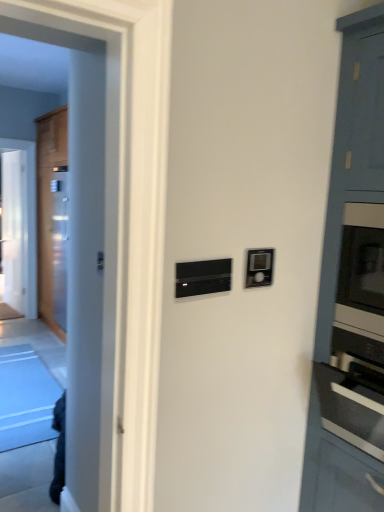
Question: Is transparent glass door at left positioned in front of satin silver oven at right?

Choices:
 (A) no
 (B) yes

Answer: (A)

Question: Does transparent glass door at left have a lesser height compared to satin silver oven at right?

Choices:
 (A) yes
 (B) no

Answer: (B)

Question: Considering the relative positions of transparent glass door at left and satin silver oven at right in the image provided, is transparent glass door at left to the right of satin silver oven at right from the viewer's perspective?

Choices:
 (A) no
 (B) yes

Answer: (A)

Question: Does transparent glass door at left have a larger size compared to satin silver oven at right?

Choices:
 (A) no
 (B) yes

Answer: (A)

Question: Is the position of transparent glass door at left more distant than that of satin silver oven at right?

Choices:
 (A) no
 (B) yes

Answer: (B)

Question: Is transparent glass door at left directly adjacent to satin silver oven at right?

Choices:
 (A) no
 (B) yes

Answer: (A)

Question: Is satin silver oven at right not within black matte thermostat at center?

Choices:
 (A) yes
 (B) no

Answer: (A)

Question: From the image's perspective, is satin silver oven at right on black matte thermostat at center?

Choices:
 (A) no
 (B) yes

Answer: (A)

Question: Is satin silver oven at right at the left side of black matte thermostat at center?

Choices:
 (A) yes
 (B) no

Answer: (B)

Question: Does satin silver oven at right have a larger size compared to black matte thermostat at center?

Choices:
 (A) yes
 (B) no

Answer: (A)

Question: From a real-world perspective, does satin silver oven at right stand above black matte thermostat at center?

Choices:
 (A) no
 (B) yes

Answer: (A)

Question: Does satin silver oven at right appear on the right side of black matte thermostat at center?

Choices:
 (A) yes
 (B) no

Answer: (A)

Question: Can you confirm if transparent glass door at left is bigger than black matte thermostat at center?

Choices:
 (A) yes
 (B) no

Answer: (A)